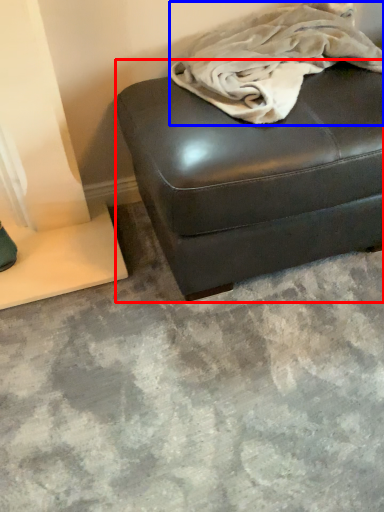
Question: Which object appears farthest to the camera in this image, furniture (highlighted by a red box) or blanket (highlighted by a blue box)?

Choices:
 (A) furniture
 (B) blanket

Answer: (A)